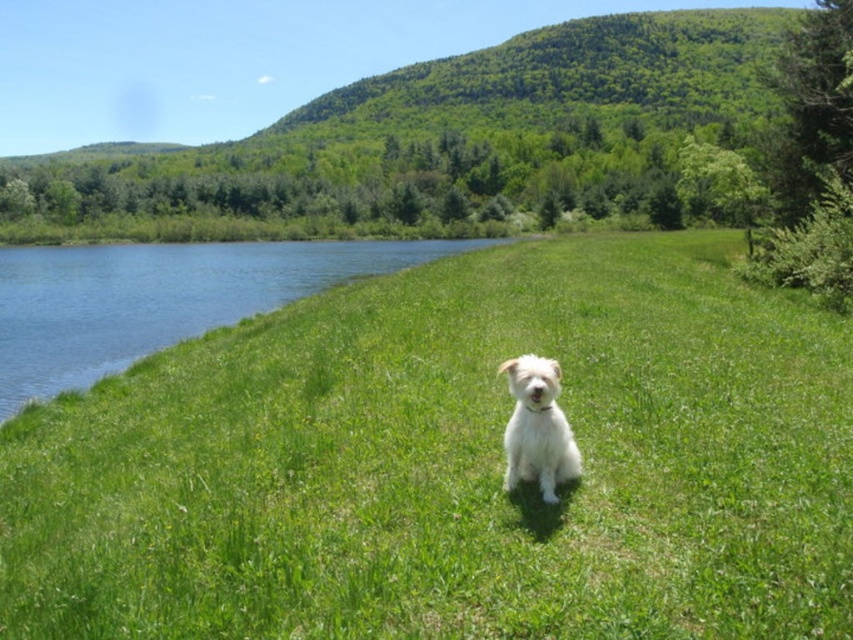
You are a gardener who wants to mow the lawn. You see the green grassy at center and the blue water at left. Which area should you avoid mowing to prevent damaging the water?

You should avoid mowing the blue water at left because it is a body of water and mowing there would cause damage.

You are standing at the center of the grassy area in the image. There is a blue water at left located at point (160, 298). Can you walk straight ahead from your current position to reach the blue water at left without deviating left or right?

The blue water at left is located at point (160, 298), which is to the left of the center position. Walking straight ahead from the center would not reach the blue water at left since it requires moving leftward.

You are a photographer standing at the edge of the blue water at left. You want to take a photo of the white fluffy dog at center. Which direction should you move to get the dog into your frame?

The blue water at left is positioned on the left side of the white fluffy dog at center, so you should move to the right to get the dog into your frame.